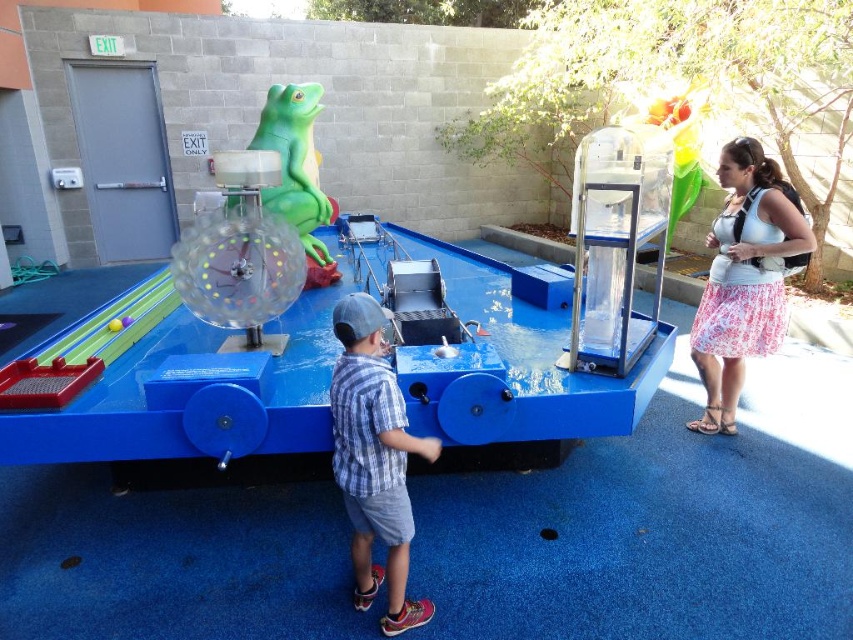
Question: Which point is farther from the camera taking this photo?

Choices:
 (A) (358, 561)
 (B) (115, 332)
 (C) (633, 408)
 (D) (711, 301)

Answer: (D)

Question: Can you confirm if translucent plastic ball at center is thinner than transparent plastic ball at center?

Choices:
 (A) no
 (B) yes

Answer: (A)

Question: Which is nearer to the translucent plastic ball at center?

Choices:
 (A) plaid shirt at center
 (B) floral skirt at right

Answer: (A)

Question: Which of the following is the farthest from the observer?

Choices:
 (A) (698, 333)
 (B) (374, 371)
 (C) (119, 330)

Answer: (A)

Question: Is floral skirt at right positioned at the back of plaid shirt at center?

Choices:
 (A) no
 (B) yes

Answer: (B)

Question: Can you confirm if translucent plastic ball at center is positioned to the right of transparent plastic ball at center?

Choices:
 (A) no
 (B) yes

Answer: (B)